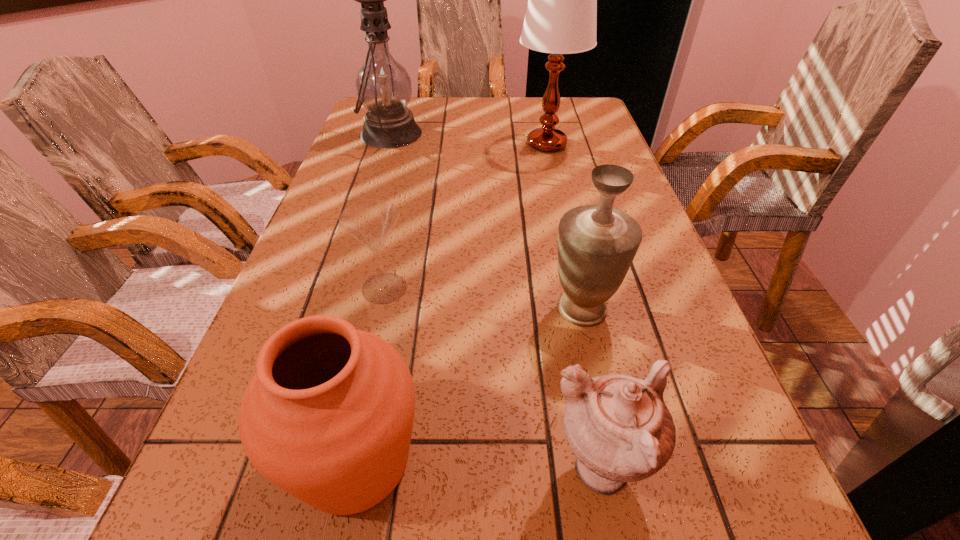
The width and height of the screenshot is (960, 540). In order to click on oil lamp in this screenshot , I will do `click(383, 85)`.

At what (x,y) coordinates should I click in order to perform the action: click on table lamp. Please return your answer as a coordinate pair (x, y). The height and width of the screenshot is (540, 960). Looking at the image, I should click on (561, 17).

Locate an element on the screen. the farthest urn is located at coordinates (596, 243).

You are a GUI agent. You are given a task and a screenshot of the screen. Output one action in this format:
    pyautogui.click(x=<x>, y=<y>)
    Task: Click on the leftmost urn
    
    Given the screenshot: What is the action you would take?
    pyautogui.click(x=328, y=416)

Where is `the second shortest object`? The image size is (960, 540). the second shortest object is located at coordinates (619, 427).

Locate an element on the screen. flute glass is located at coordinates (370, 222).

Identify the location of vacant point located on the right of the oil lamp. (494, 134).

Where is `free space located on the left of the table lamp`? The height and width of the screenshot is (540, 960). free space located on the left of the table lamp is located at coordinates (474, 144).

Locate an element on the screen. The width and height of the screenshot is (960, 540). free region located on the front of the farthest urn is located at coordinates (606, 416).

You are a GUI agent. You are given a task and a screenshot of the screen. Output one action in this format:
    pyautogui.click(x=<x>, y=<y>)
    Task: Click on the free space located on the left of the leftmost urn
    The width and height of the screenshot is (960, 540).
    Given the screenshot: What is the action you would take?
    pyautogui.click(x=252, y=460)